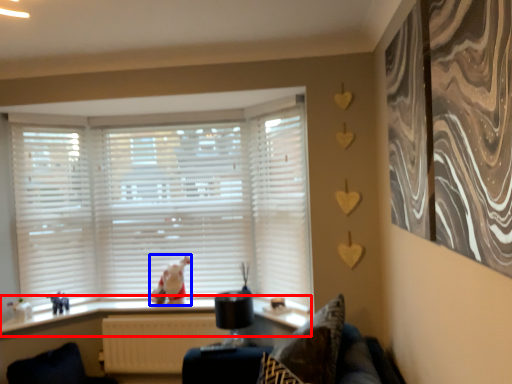
Question: Which of the following is the closest to the observer, window sill (highlighted by a red box) or animal (highlighted by a blue box)?

Choices:
 (A) window sill
 (B) animal

Answer: (A)